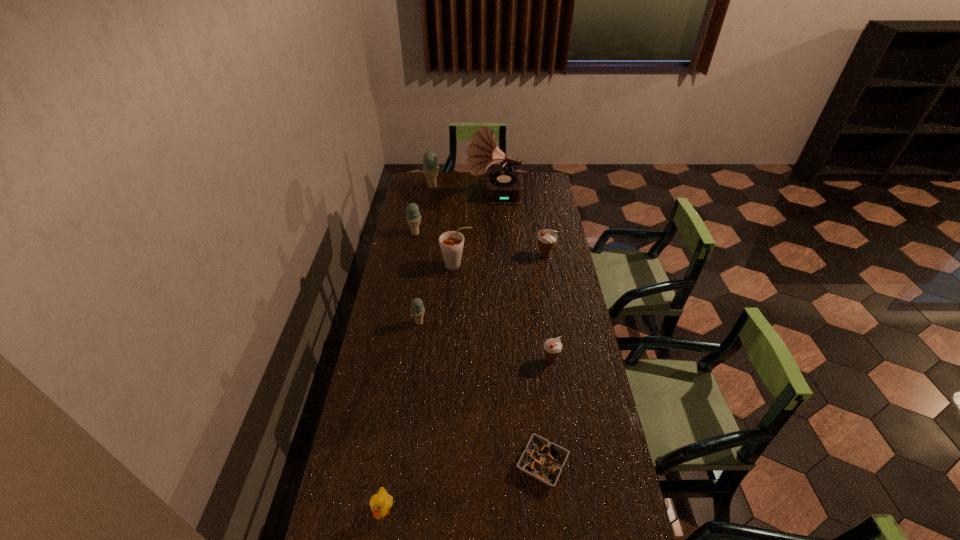
The width and height of the screenshot is (960, 540). I want to click on blank region between the sixth farthest object and the bigger white icecream, so click(482, 289).

Locate an element on the screen. Image resolution: width=960 pixels, height=540 pixels. vacant area that lies between the third nearest object and the bigger white icecream is located at coordinates (548, 308).

The image size is (960, 540). In order to click on free space between the gray ashtray and the bigger white icecream in this screenshot , I will do `click(543, 360)`.

The image size is (960, 540). In order to click on object identified as the second closest to the root beer in this screenshot , I will do `click(417, 309)`.

Find the location of a particular element. The width and height of the screenshot is (960, 540). object that can be found as the fifth closest to the tallest object is located at coordinates (417, 309).

Identify the location of ice cream identified as the third closest to the eighth farthest object. (547, 239).

Select which ice cream appears as the closest to the second nearest ice cream. Please provide its 2D coordinates. Your answer should be formatted as a tuple, i.e. [(x, y)], where the tuple contains the x and y coordinates of a point satisfying the conditions above.

[(552, 347)]

Find the location of `blue ice cream that stands as the closest to the farther white icecream`. blue ice cream that stands as the closest to the farther white icecream is located at coordinates (413, 217).

This screenshot has height=540, width=960. I want to click on blue ice cream that is the closest to the nearest blue ice cream, so click(x=413, y=217).

This screenshot has height=540, width=960. I want to click on vacant position in the image that satisfies the following two spatial constraints: 1. on the back side of the nearest ice cream; 2. on the left side of the farther white icecream, so click(x=536, y=256).